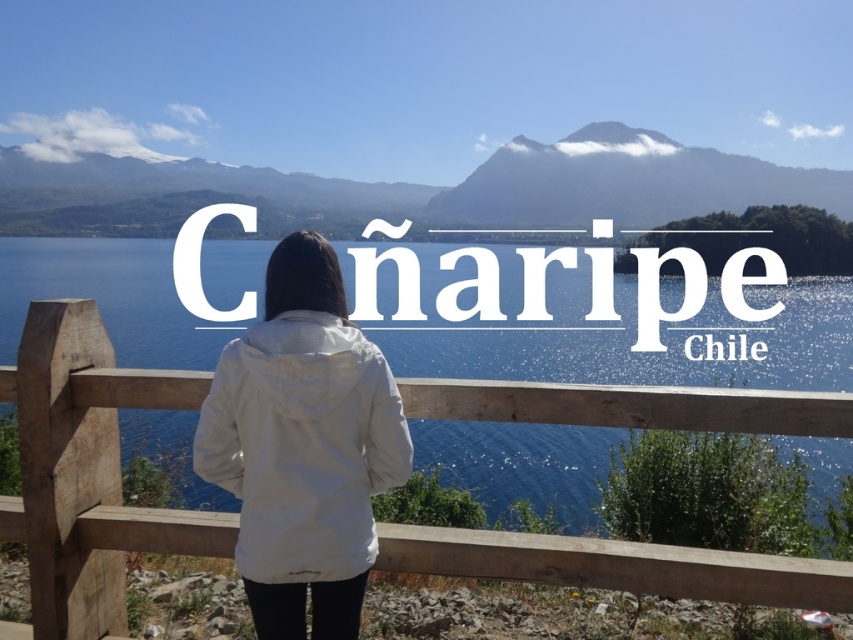
Question: Is snowy mountain at upper center bigger than dark gray rocky mountain at upper center?

Choices:
 (A) no
 (B) yes

Answer: (B)

Question: Estimate the real-world distances between objects in this image. Which object is closer to the dark gray rocky mountain at upper center?

Choices:
 (A) wooden at center
 (B) white fabric jacket at center
 (C) snowy mountain at upper center

Answer: (C)

Question: Does wooden at center appear over dark gray rocky mountain at upper center?

Choices:
 (A) yes
 (B) no

Answer: (B)

Question: Can you confirm if white fabric jacket at center is wider than dark gray rocky mountain at upper center?

Choices:
 (A) yes
 (B) no

Answer: (B)

Question: Which object appears closest to the camera in this image?

Choices:
 (A) dark gray rocky mountain at upper center
 (B) snowy mountain at upper center
 (C) wooden at center

Answer: (C)

Question: Which object appears closest to the camera in this image?

Choices:
 (A) dark gray rocky mountain at upper center
 (B) snowy mountain at upper center
 (C) wooden at center
 (D) white fabric jacket at center

Answer: (D)